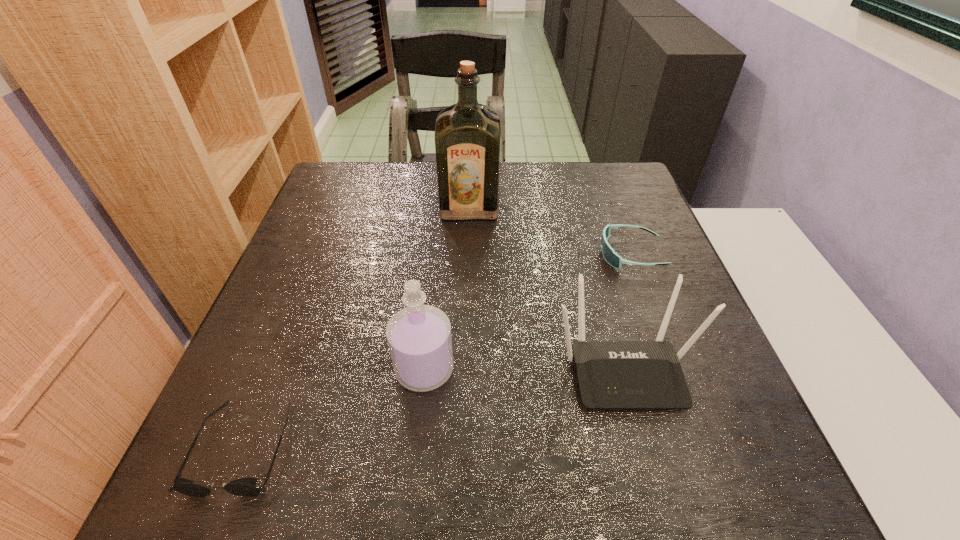
Find the location of a particular element. The width and height of the screenshot is (960, 540). free space between the third tallest object and the goggles is located at coordinates (628, 311).

Where is `free area in between the fourth nearest object and the third shortest object`? This screenshot has height=540, width=960. free area in between the fourth nearest object and the third shortest object is located at coordinates coord(628,311).

Find the location of a particular element. The height and width of the screenshot is (540, 960). free space between the fourth shortest object and the tallest object is located at coordinates (447, 289).

Where is `free space between the third shortest object and the tallest object`? free space between the third shortest object and the tallest object is located at coordinates (547, 288).

I want to click on object that ranks as the second closest to the fourth nearest object, so click(467, 134).

You are a GUI agent. You are given a task and a screenshot of the screen. Output one action in this format:
    pyautogui.click(x=<x>, y=<y>)
    Task: Click on the object identified as the closest to the tallest object
    
    Given the screenshot: What is the action you would take?
    pyautogui.click(x=613, y=259)

I want to click on vacant space that satisfies the following two spatial constraints: 1. on the front-facing side of the goggles; 2. on the front-facing side of the leftmost object, so pos(703,447).